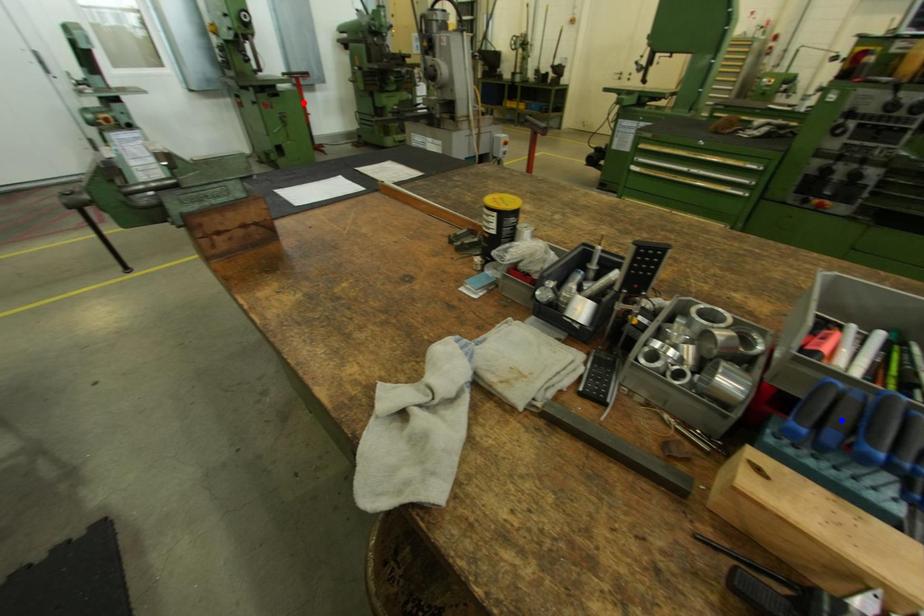
Question: Two points are marked on the image. Which point is closer to the camera?

Choices:
 (A) Blue point is closer.
 (B) Red point is closer.

Answer: (A)